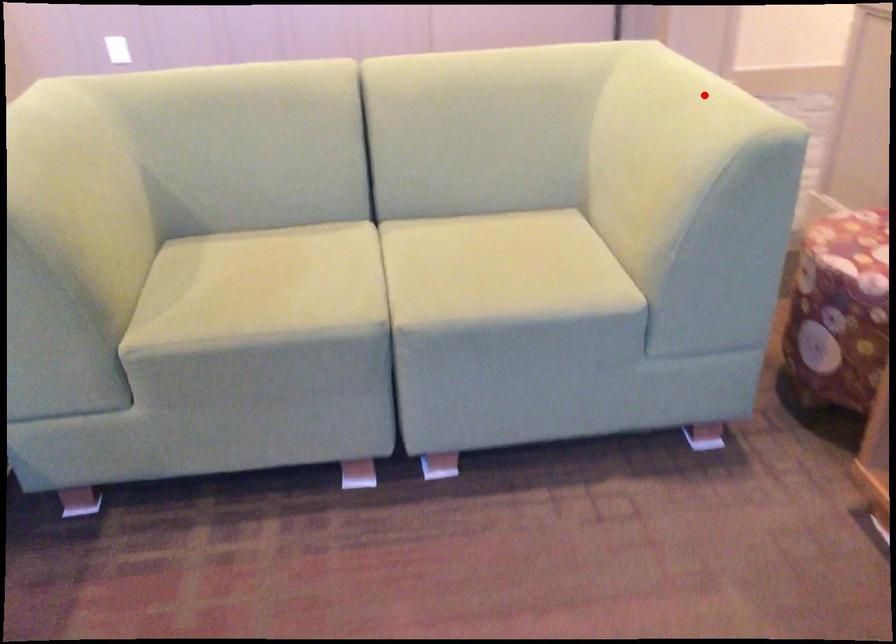
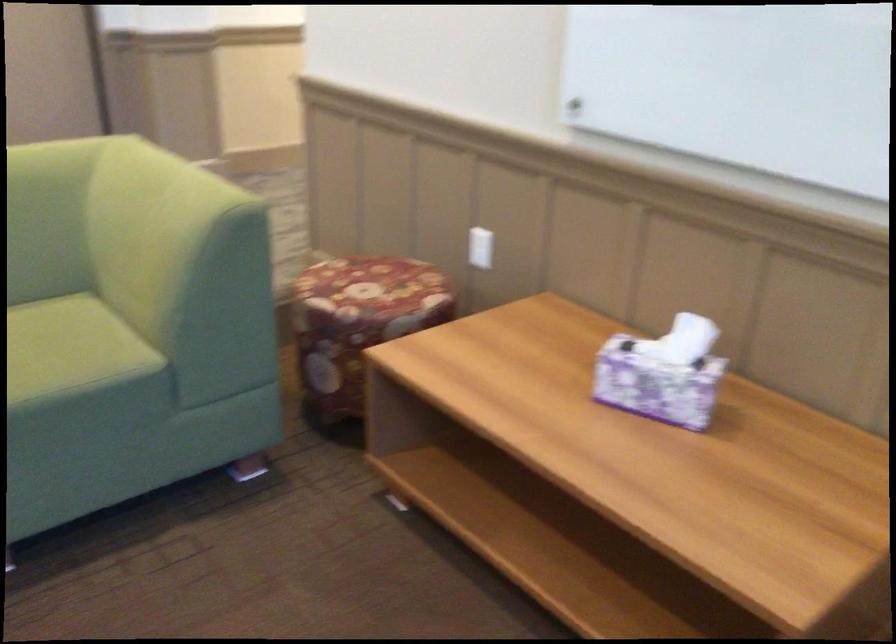
In the second image, find the point that corresponds to the highlighted location in the first image.

(181, 184)